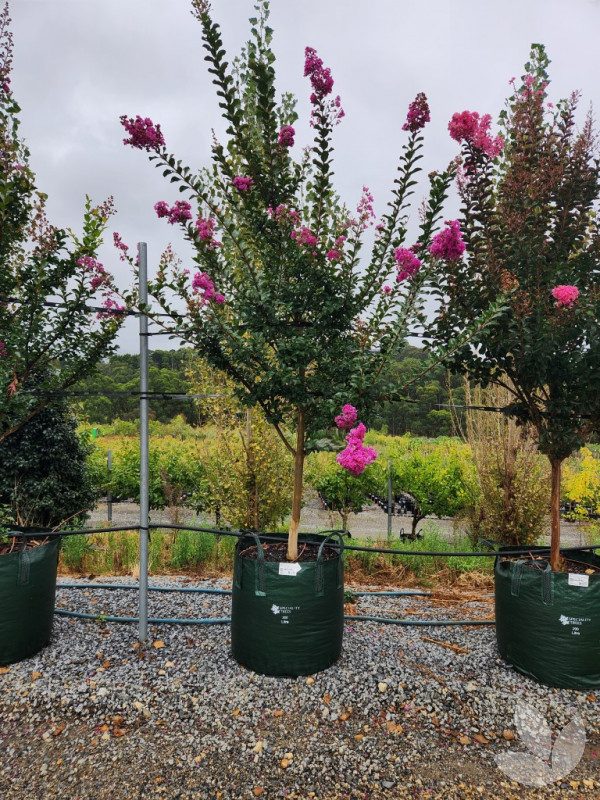
I want to click on handles, so click(260, 552), click(322, 548), click(519, 566), click(24, 546).